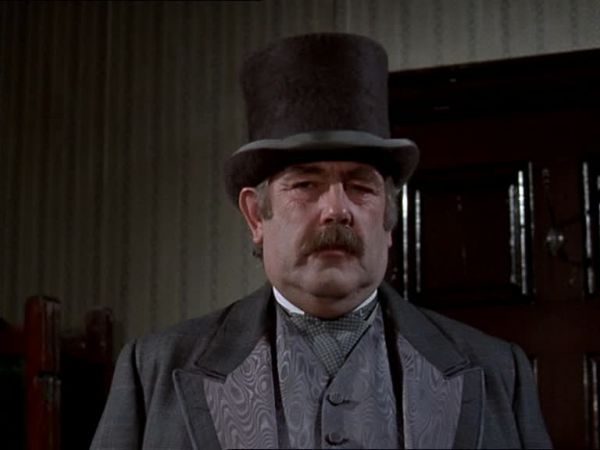
Locate an element on the screen. The width and height of the screenshot is (600, 450). striped wallpaper is located at coordinates (100, 158).